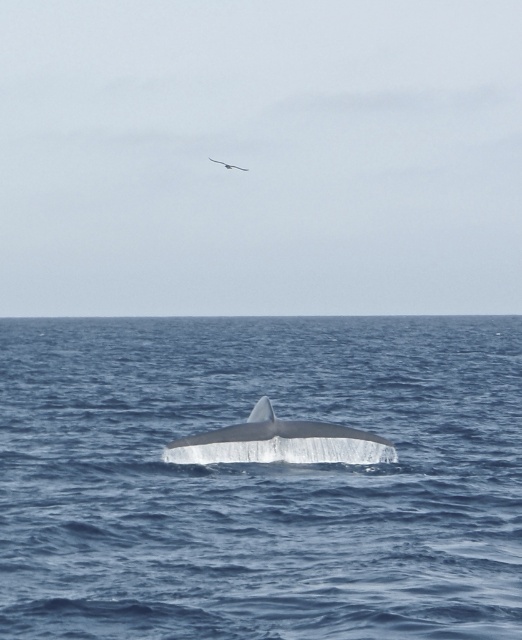
You are a marine biologist observing the ocean surface. You notice a point at coordinates (259, 480). Based on the scene, what type of surface is this point located on?

The point at coordinates (259, 480) is located on the blue smooth water at center.

You are standing on a boat looking at the blue smooth water at center and the white smooth whale at center. Which object is nearer to you?

The blue smooth water at center is closer to the viewer than the white smooth whale at center.